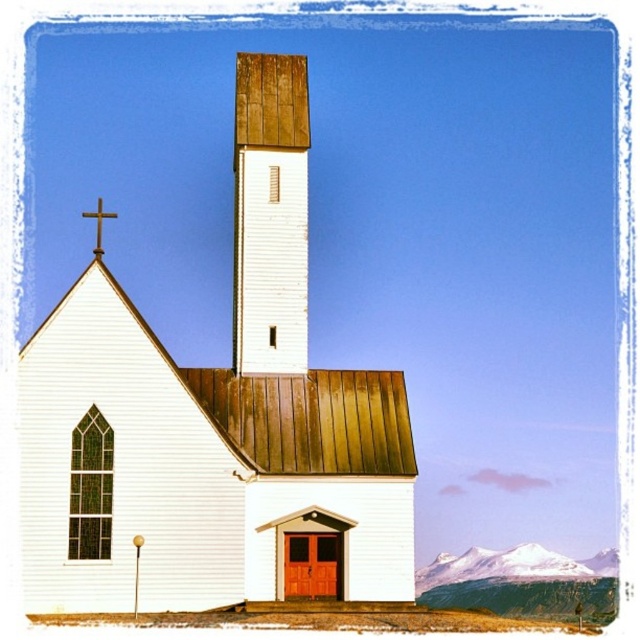
Question: Which object is closer to the camera taking this photo?

Choices:
 (A) gold metallic cross at upper left
 (B) white wooden church at center

Answer: (B)

Question: Which object appears closest to the camera in this image?

Choices:
 (A) wooden shingles at center
 (B) snowy white mountain at lower right
 (C) gold metallic cross at upper left
 (D) white wooden church at center

Answer: (D)

Question: Which point appears closest to the camera in this image?

Choices:
 (A) tap(83, 212)
 (B) tap(540, 577)

Answer: (B)

Question: Is white wooden church at center wider than snowy white mountain at lower right?

Choices:
 (A) yes
 (B) no

Answer: (B)

Question: Is white wooden church at center positioned before wooden shingles at center?

Choices:
 (A) no
 (B) yes

Answer: (B)

Question: Considering the relative positions of wooden shingles at center and gold metallic cross at upper left in the image provided, where is wooden shingles at center located with respect to gold metallic cross at upper left?

Choices:
 (A) below
 (B) above

Answer: (B)